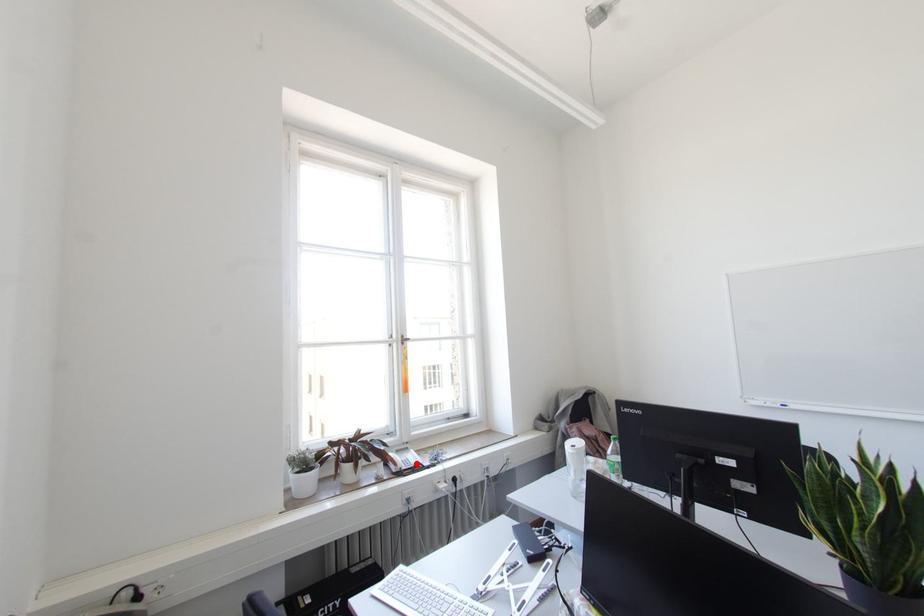
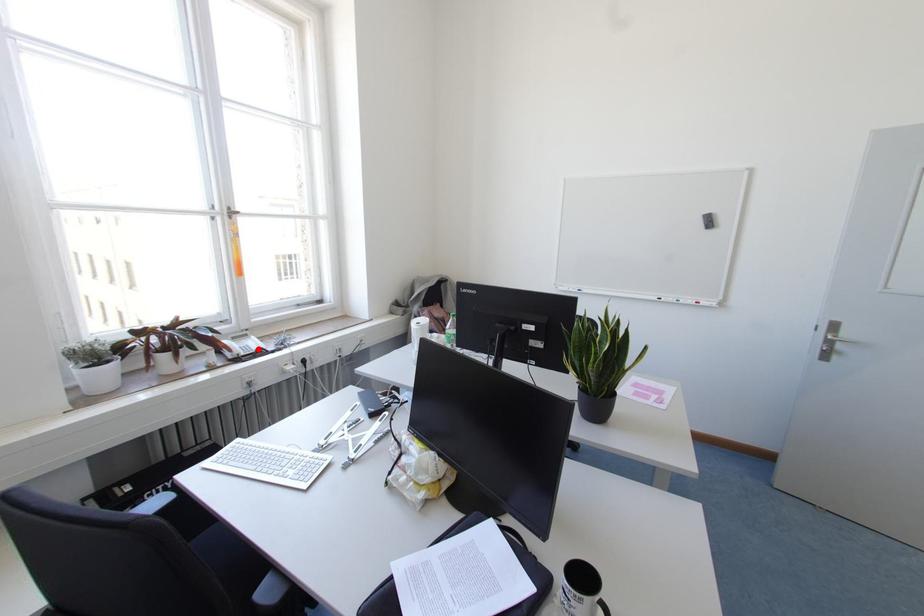
I am providing you with two images of the same scene from different viewpoints. A red point is marked on the first image and another point is marked on the second image. Does the point marked in image1 correspond to the same location as the one in image2?

Yes